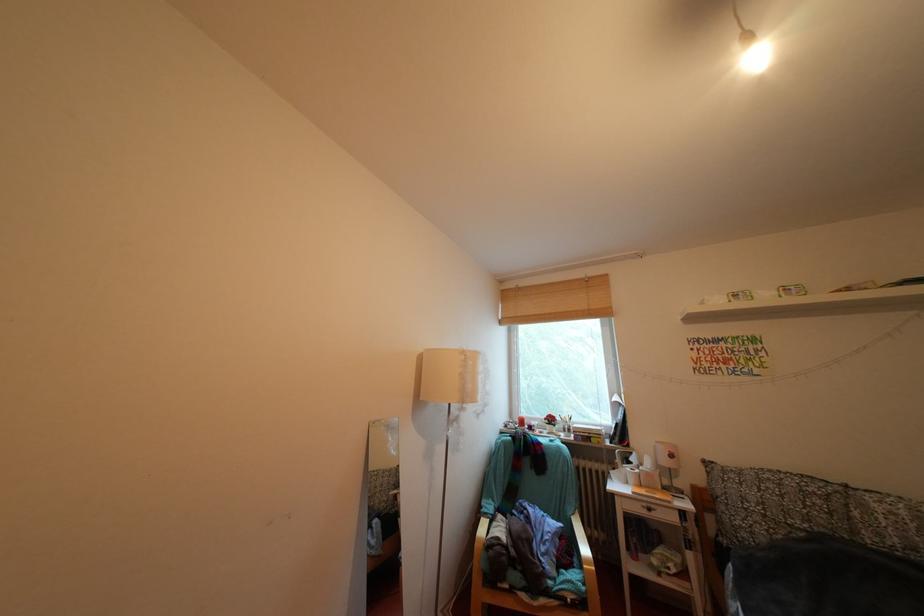
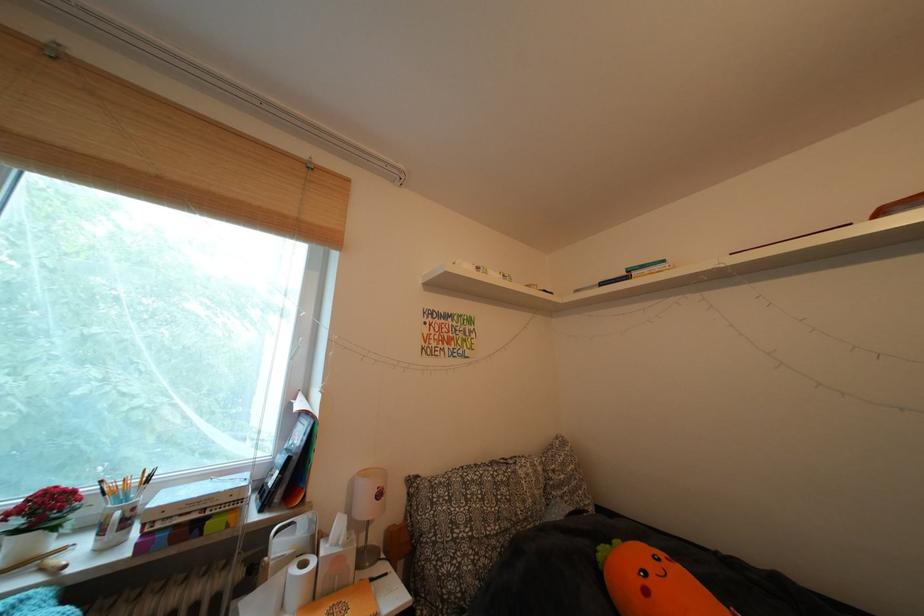
Question: I am providing you with two images of the same scene from different viewpoints. Please identify which objects are invisible in image2.

Choices:
 (A) white flower pot
 (B) white pen holder
 (C) paper towel roll
 (D) none of these

Answer: (D)